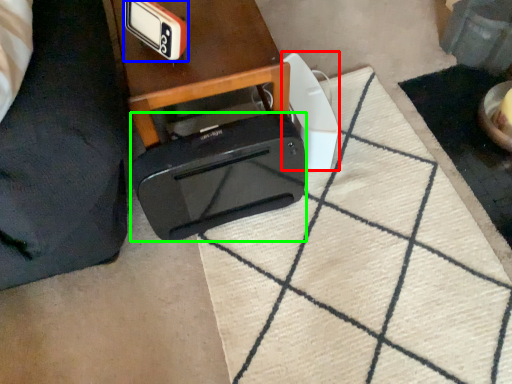
Question: Which object is positioned farthest from appliance (highlighted by a red box)? Select from gadget (highlighted by a blue box) and toaster (highlighted by a green box).

Choices:
 (A) gadget
 (B) toaster

Answer: (A)